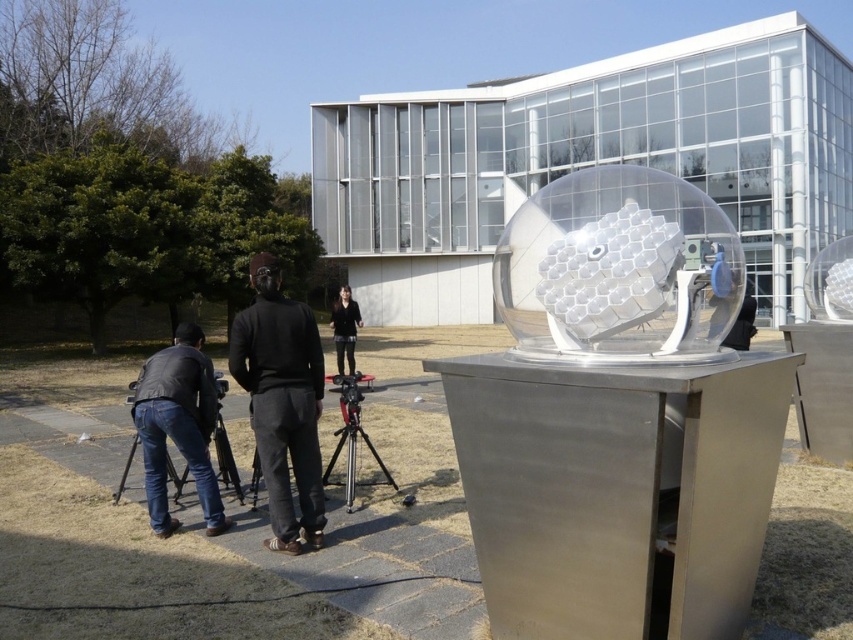
Consider the image. You are standing at the entrance of the building and see the black matte pants at center. Can you tell me what object is located exactly at the position marked by the coordinates point (282, 401)?

The point (282, 401) indicates the location of the black matte pants at center.